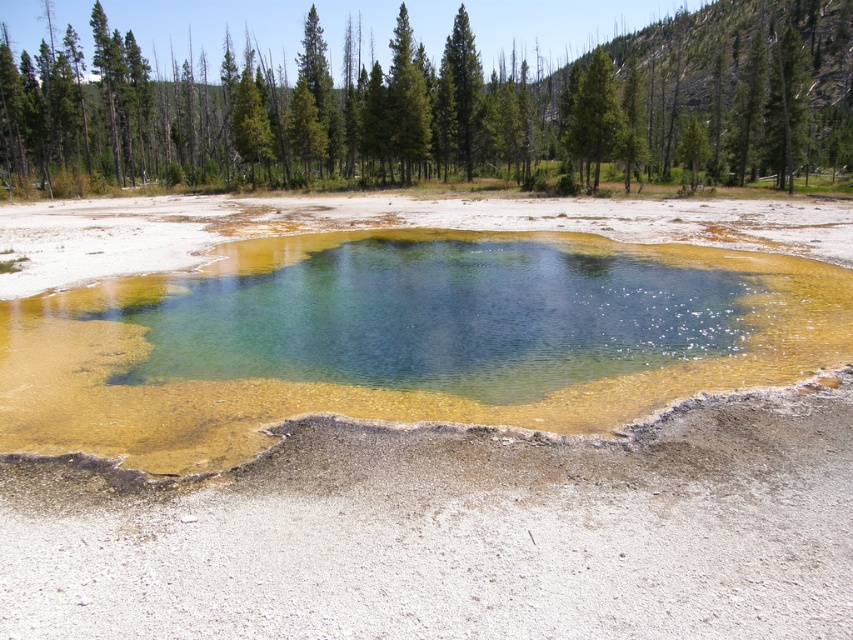
Question: Can you confirm if green textured tree at upper center is bigger than green coniferous tree at upper center?

Choices:
 (A) yes
 (B) no

Answer: (A)

Question: Which object is closer to the camera taking this photo?

Choices:
 (A) green coniferous tree at upper center
 (B) green leafy tree at upper center
 (C) green textured tree at upper center

Answer: (C)

Question: Does green leafy tree at upper center have a greater width compared to green coniferous tree at upper center?

Choices:
 (A) yes
 (B) no

Answer: (A)

Question: Considering the real-world distances, which object is closest to the green leafy tree at upper center?

Choices:
 (A) green textured tree at upper center
 (B) green coniferous tree at upper center

Answer: (A)

Question: Which object is the closest to the green leafy tree at upper center?

Choices:
 (A) green coniferous tree at upper center
 (B) green textured tree at upper center

Answer: (B)

Question: Can you confirm if green textured tree at upper center is wider than green coniferous tree at upper center?

Choices:
 (A) yes
 (B) no

Answer: (A)